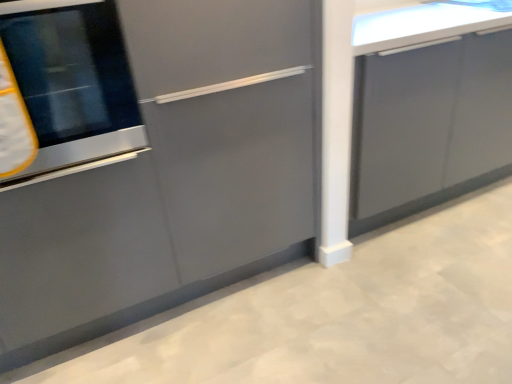
What do you see at coordinates (71, 81) in the screenshot? This screenshot has height=384, width=512. I see `stainless steel oven at left` at bounding box center [71, 81].

You are a GUI agent. You are given a task and a screenshot of the screen. Output one action in this format:
    pyautogui.click(x=<x>, y=<y>)
    Task: Click on the stainless steel oven at left
    This screenshot has width=512, height=384.
    Given the screenshot: What is the action you would take?
    pyautogui.click(x=71, y=81)

The width and height of the screenshot is (512, 384). I want to click on matte gray cabinet at left, which is the first cabinetry in left-to-right order, so click(x=151, y=159).

Image resolution: width=512 pixels, height=384 pixels. In order to click on stainless steel oven at left in this screenshot , I will do `click(71, 81)`.

Could glossy gray cabinet at right, placed as the 1th cabinetry when sorted from right to left, be considered to be inside matte gray cabinet at left, acting as the 2th cabinetry starting from the right?

No.

What's the angular difference between matte gray cabinet at left, acting as the 2th cabinetry starting from the right, and glossy gray cabinet at right, positioned as the second cabinetry in left-to-right order,'s facing directions?

They differ by 0.000365 degrees in their facing directions.

Between matte gray cabinet at left, acting as the 2th cabinetry starting from the right, and glossy gray cabinet at right, placed as the 1th cabinetry when sorted from right to left, which one has larger size?

Bigger between the two is glossy gray cabinet at right, placed as the 1th cabinetry when sorted from right to left.

Which is correct: glossy gray cabinet at right, placed as the 1th cabinetry when sorted from right to left, is inside matte gray cabinet at left, acting as the 2th cabinetry starting from the right, or outside of it?

glossy gray cabinet at right, placed as the 1th cabinetry when sorted from right to left, lies outside matte gray cabinet at left, acting as the 2th cabinetry starting from the right.

How many degrees apart are the facing directions of glossy gray cabinet at right, positioned as the second cabinetry in left-to-right order, and matte gray cabinet at left, which is the first cabinetry in left-to-right order?

They differ by 0.000365 degrees in their facing directions.

Which of these two, glossy gray cabinet at right, positioned as the second cabinetry in left-to-right order, or matte gray cabinet at left, which is the first cabinetry in left-to-right order, is smaller?

matte gray cabinet at left, which is the first cabinetry in left-to-right order, is smaller.

From a real-world perspective, is glossy gray cabinet at right, positioned as the second cabinetry in left-to-right order, physically located above or below matte gray cabinet at left, acting as the 2th cabinetry starting from the right?

In terms of real-world spatial position, glossy gray cabinet at right, positioned as the second cabinetry in left-to-right order, is below matte gray cabinet at left, acting as the 2th cabinetry starting from the right.

Consider the image. From the image's perspective, is stainless steel oven at left above or below glossy gray cabinet at right, placed as the 1th cabinetry when sorted from right to left?

stainless steel oven at left is situated lower than glossy gray cabinet at right, placed as the 1th cabinetry when sorted from right to left, in the image.

Between stainless steel oven at left and glossy gray cabinet at right, placed as the 1th cabinetry when sorted from right to left, which one has more height?

glossy gray cabinet at right, placed as the 1th cabinetry when sorted from right to left, is taller.

Is glossy gray cabinet at right, placed as the 1th cabinetry when sorted from right to left, surrounded by stainless steel oven at left?

Definitely not — glossy gray cabinet at right, placed as the 1th cabinetry when sorted from right to left, is not inside stainless steel oven at left.

Which object is positioned more to the right, stainless steel oven at left or glossy gray cabinet at right, placed as the 1th cabinetry when sorted from right to left?

Positioned to the right is glossy gray cabinet at right, placed as the 1th cabinetry when sorted from right to left.

Is stainless steel oven at left smaller than matte gray cabinet at left, which is the first cabinetry in left-to-right order?

Correct, stainless steel oven at left occupies less space than matte gray cabinet at left, which is the first cabinetry in left-to-right order.

Is stainless steel oven at left turned away from matte gray cabinet at left, which is the first cabinetry in left-to-right order?

Yes, stainless steel oven at left's orientation is away from matte gray cabinet at left, which is the first cabinetry in left-to-right order.

Identify the location of cabinetry in front of the stainless steel oven at left. Image resolution: width=512 pixels, height=384 pixels. (151, 159).

In the scene shown: From the image's perspective, which object appears higher, matte gray cabinet at left, which is the first cabinetry in left-to-right order, or stainless steel oven at left?

stainless steel oven at left.

Considering the relative sizes of matte gray cabinet at left, acting as the 2th cabinetry starting from the right, and stainless steel oven at left in the image provided, is matte gray cabinet at left, acting as the 2th cabinetry starting from the right, thinner than stainless steel oven at left?

Yes.

Is the depth of matte gray cabinet at left, which is the first cabinetry in left-to-right order, less than that of stainless steel oven at left?

Yes.

The image size is (512, 384). Find the location of `oven in front of the glossy gray cabinet at right, positioned as the second cabinetry in left-to-right order`. oven in front of the glossy gray cabinet at right, positioned as the second cabinetry in left-to-right order is located at coordinates (71, 81).

Does glossy gray cabinet at right, placed as the 1th cabinetry when sorted from right to left, turn towards stainless steel oven at left?

No, glossy gray cabinet at right, placed as the 1th cabinetry when sorted from right to left, is not oriented towards stainless steel oven at left.

Does glossy gray cabinet at right, positioned as the second cabinetry in left-to-right order, lie in front of stainless steel oven at left?

No, it is not.

From a real-world perspective, who is located lower, glossy gray cabinet at right, placed as the 1th cabinetry when sorted from right to left, or stainless steel oven at left?

glossy gray cabinet at right, placed as the 1th cabinetry when sorted from right to left, from a real-world perspective.

At what (x,y) coordinates should I click in order to perform the action: click on cabinetry on the right of matte gray cabinet at left, which is the first cabinetry in left-to-right order. Please return your answer as a coordinate pair (x, y). Looking at the image, I should click on (430, 125).

You are a GUI agent. You are given a task and a screenshot of the screen. Output one action in this format:
    pyautogui.click(x=<x>, y=<y>)
    Task: Click on the cabinetry below the matte gray cabinet at left, which is the first cabinetry in left-to-right order (from a real-world perspective)
    
    Given the screenshot: What is the action you would take?
    pyautogui.click(x=430, y=125)

From the image, which object appears to be nearer to stainless steel oven at left, matte gray cabinet at left, which is the first cabinetry in left-to-right order, or glossy gray cabinet at right, positioned as the second cabinetry in left-to-right order?

The object closer to stainless steel oven at left is matte gray cabinet at left, which is the first cabinetry in left-to-right order.

Estimate the real-world distances between objects in this image. Which object is closer to matte gray cabinet at left, which is the first cabinetry in left-to-right order, stainless steel oven at left or glossy gray cabinet at right, placed as the 1th cabinetry when sorted from right to left?

stainless steel oven at left is positioned closer to the anchor matte gray cabinet at left, which is the first cabinetry in left-to-right order.

Considering their positions, is stainless steel oven at left positioned closer to glossy gray cabinet at right, positioned as the second cabinetry in left-to-right order, than matte gray cabinet at left, which is the first cabinetry in left-to-right order?

Among the two, matte gray cabinet at left, which is the first cabinetry in left-to-right order, is located nearer to glossy gray cabinet at right, positioned as the second cabinetry in left-to-right order.

Which object lies further to the anchor point matte gray cabinet at left, which is the first cabinetry in left-to-right order, glossy gray cabinet at right, positioned as the second cabinetry in left-to-right order, or stainless steel oven at left?

The object further to matte gray cabinet at left, which is the first cabinetry in left-to-right order, is glossy gray cabinet at right, positioned as the second cabinetry in left-to-right order.

From the image, which object appears to be farther from stainless steel oven at left, glossy gray cabinet at right, positioned as the second cabinetry in left-to-right order, or matte gray cabinet at left, acting as the 2th cabinetry starting from the right?

The object further to stainless steel oven at left is glossy gray cabinet at right, positioned as the second cabinetry in left-to-right order.

Based on their spatial positions, is matte gray cabinet at left, which is the first cabinetry in left-to-right order, or stainless steel oven at left closer to glossy gray cabinet at right, placed as the 1th cabinetry when sorted from right to left?

matte gray cabinet at left, which is the first cabinetry in left-to-right order, is positioned closer to the anchor glossy gray cabinet at right, placed as the 1th cabinetry when sorted from right to left.

Identify the location of cabinetry between stainless steel oven at left and glossy gray cabinet at right, positioned as the second cabinetry in left-to-right order. (151, 159).